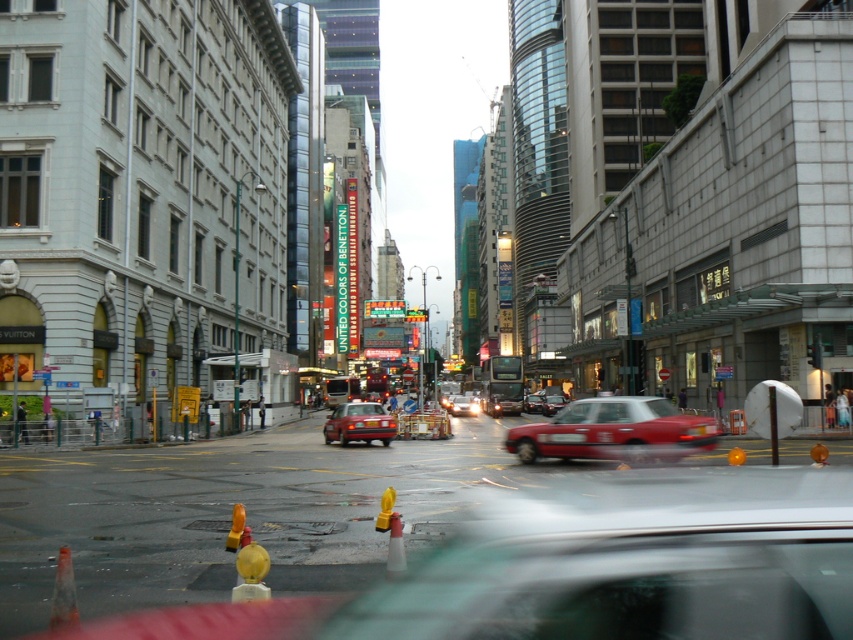
Question: Which of the following is the farthest from the observer?

Choices:
 (A) (64, 589)
 (B) (364, 428)
 (C) (508, 451)
 (D) (242, 513)

Answer: (B)

Question: Which of the following is the closest to the observer?

Choices:
 (A) (74, 616)
 (B) (403, 550)
 (C) (236, 547)
 (D) (476, 410)

Answer: (A)

Question: Can you confirm if shiny red sedan at center is smaller than orange plastic traffic cone at center?

Choices:
 (A) no
 (B) yes

Answer: (A)

Question: Which of the following is the farthest from the observer?

Choices:
 (A) shiny red sedan at center
 (B) matte red sedan at center
 (C) orange rubber traffic cone at lower center
 (D) orange plastic traffic cone at lower left

Answer: (B)

Question: Observing the image, what is the correct spatial positioning of shiny red sedan at center in reference to orange rubber traffic cone at lower center?

Choices:
 (A) right
 (B) left

Answer: (B)

Question: Is shiny red sedan at center wider than matte red sedan at center?

Choices:
 (A) no
 (B) yes

Answer: (B)